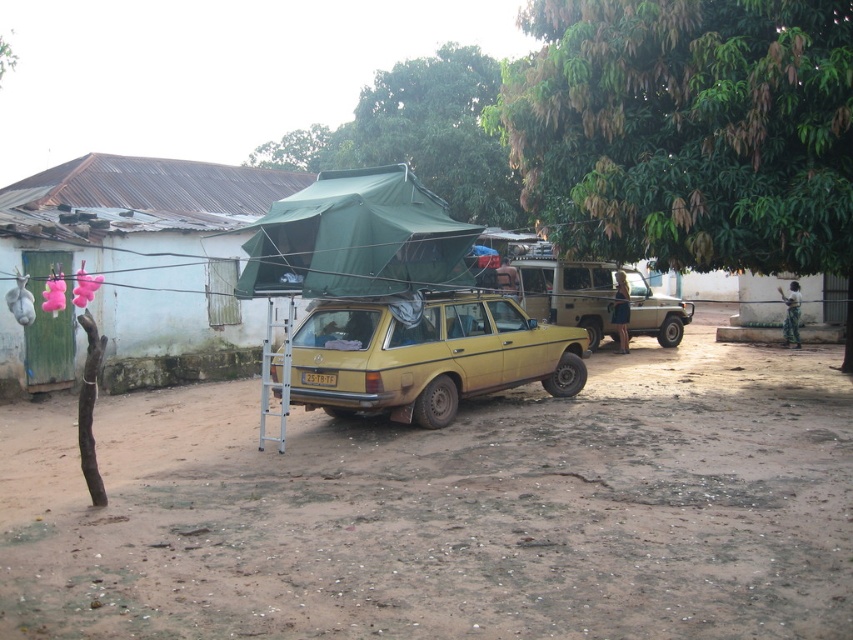
Question: Which object is the closest to the white painted wood hut at left?

Choices:
 (A) green fabric tent at upper center
 (B) dull brown dirt at center
 (C) tan matte jeep at center

Answer: (B)

Question: Considering the real-world distances, which object is closest to the yellow plastic license plate at center?

Choices:
 (A) tan matte jeep at center
 (B) green leafy tree at upper right
 (C) yellow matte station wagon at center

Answer: (C)

Question: Which of the following is the farthest from the observer?

Choices:
 (A) (120, 385)
 (B) (398, 189)
 (C) (701, 134)

Answer: (A)

Question: Can you confirm if green fabric tent at upper center is positioned to the left of yellow plastic license plate at center?

Choices:
 (A) no
 (B) yes

Answer: (B)

Question: Does green fabric tent at upper center appear on the left side of tan matte jeep at center?

Choices:
 (A) no
 (B) yes

Answer: (B)

Question: Can you confirm if green leafy tree at upper right is positioned to the left of yellow matte station wagon at center?

Choices:
 (A) yes
 (B) no

Answer: (B)